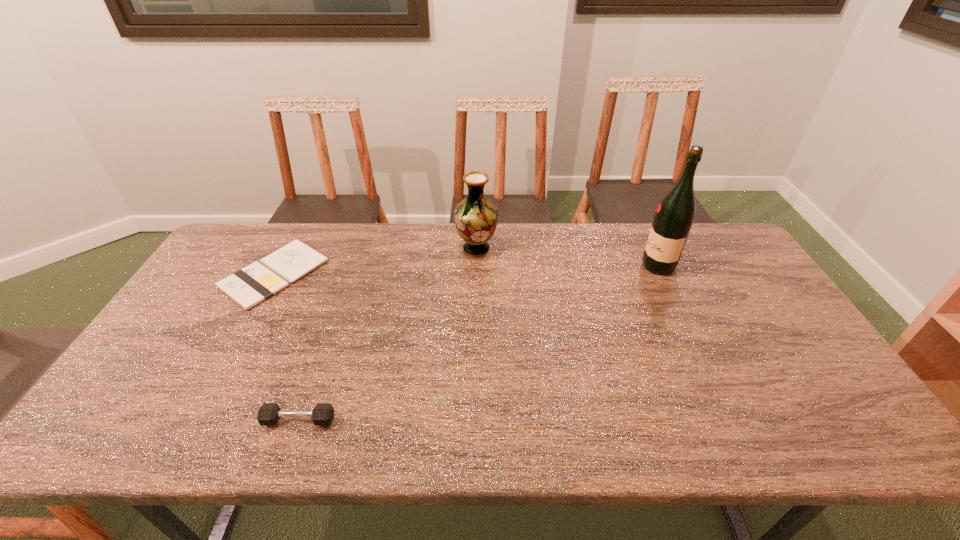
Where is `vacant region located on the left of the second object from right to left`? Image resolution: width=960 pixels, height=540 pixels. vacant region located on the left of the second object from right to left is located at coordinates (349, 249).

What are the coordinates of `vacant region located on the left of the dumbbell` in the screenshot? It's located at (167, 420).

The height and width of the screenshot is (540, 960). In order to click on blank space located on the front of the shortest object in this screenshot , I will do coord(240,338).

The width and height of the screenshot is (960, 540). Find the location of `liquor present at the far edge`. liquor present at the far edge is located at coordinates (674, 217).

The height and width of the screenshot is (540, 960). What are the coordinates of `vase positioned at the far edge` in the screenshot? It's located at (476, 217).

Where is `notepad present at the far edge`? notepad present at the far edge is located at coordinates (248, 287).

Identify the location of object positioned at the near edge. The image size is (960, 540). (268, 414).

At what (x,y) coordinates should I click in order to perform the action: click on object present at the left edge. Please return your answer as a coordinate pair (x, y). This screenshot has height=540, width=960. Looking at the image, I should click on (248, 287).

Locate an element on the screen. The height and width of the screenshot is (540, 960). object at the far left corner is located at coordinates (248, 287).

Identify the location of vacant space at the far edge of the desktop. This screenshot has width=960, height=540. (303, 238).